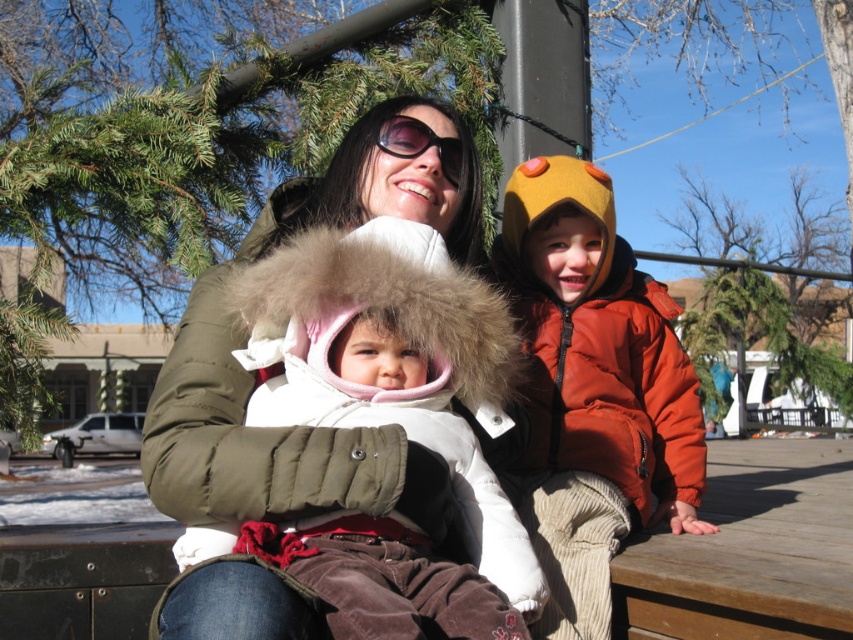
You are a photographer standing in the park and want to take a photo of the white fur coat at center and orange puffy jacket at right. If your camera can capture objects within a 1 meter range, will both subjects fit in the frame?

The white fur coat at center and orange puffy jacket at right are 72.52 centimeters apart from each other. Since 72.52 cm is less than 1 meter, both subjects will fit within the camera frame.

You are a photographer trying to capture a photo of the white fur coat at center and the orange puffy jacket at right. Which one is closer to the camera?

The white fur coat at center is closer to the camera because it is in front of the orange puffy jacket at right.